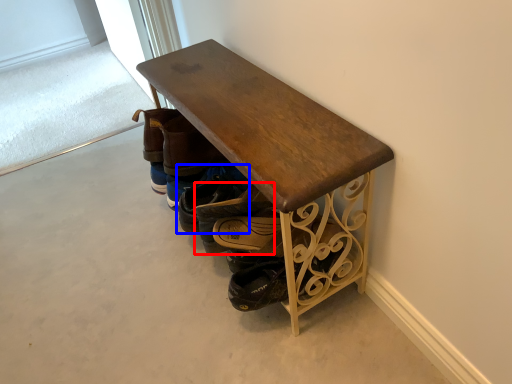
Question: Which of the following is the closest to the observer, footwear (highlighted by a red box) or footwear (highlighted by a blue box)?

Choices:
 (A) footwear
 (B) footwear

Answer: (A)